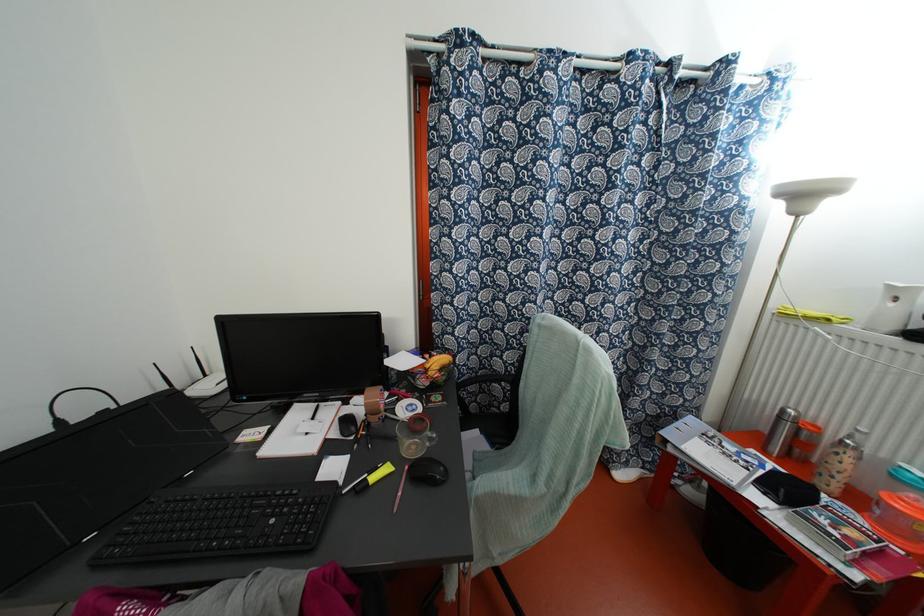
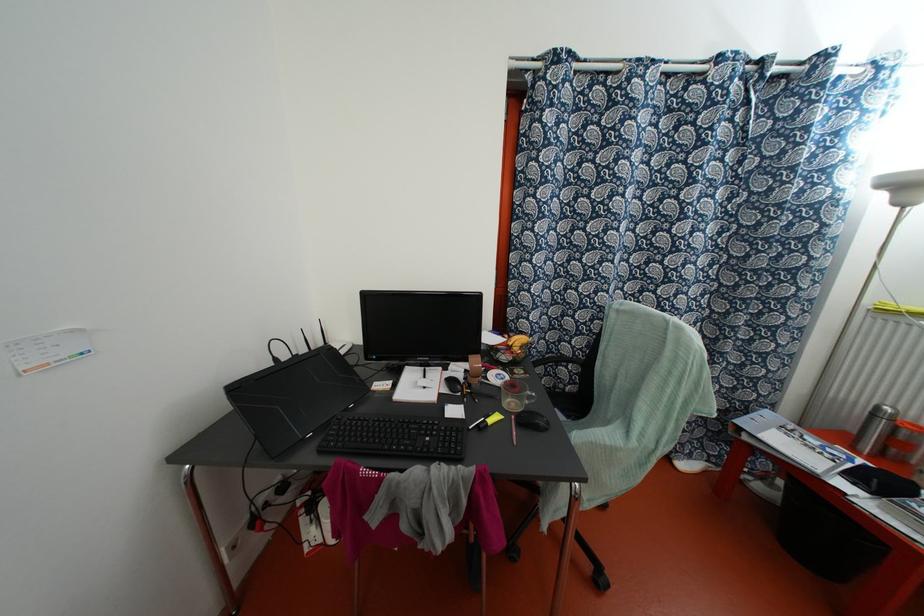
In the second image, find the point that corresponds to (299,431) in the first image.

(418, 386)